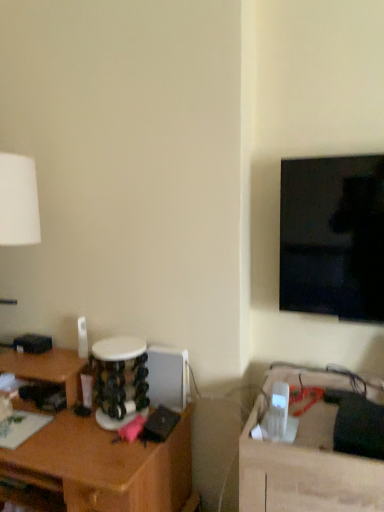
Question: Should I look upward or downward to see black glossy tv at upper right?

Choices:
 (A) down
 (B) up

Answer: (B)

Question: Is the surface of black glossy tv at upper right in direct contact with wooden table at lower right?

Choices:
 (A) no
 (B) yes

Answer: (A)

Question: Does black glossy tv at upper right have a larger size compared to wooden table at lower right?

Choices:
 (A) no
 (B) yes

Answer: (A)

Question: Is black glossy tv at upper right thinner than wooden table at lower right?

Choices:
 (A) yes
 (B) no

Answer: (A)

Question: Does black glossy tv at upper right have a smaller size compared to wooden table at lower right?

Choices:
 (A) yes
 (B) no

Answer: (A)

Question: Would you consider black glossy tv at upper right to be distant from wooden table at lower right?

Choices:
 (A) yes
 (B) no

Answer: (B)

Question: From a real-world perspective, is black glossy tv at upper right physically below wooden table at lower right?

Choices:
 (A) yes
 (B) no

Answer: (B)

Question: Is wooden table at lower right shorter than brown wood desk at left?

Choices:
 (A) no
 (B) yes

Answer: (B)

Question: Is wooden table at lower right further to the viewer compared to brown wood desk at left?

Choices:
 (A) yes
 (B) no

Answer: (B)

Question: Can you confirm if wooden table at lower right is positioned to the right of brown wood desk at left?

Choices:
 (A) no
 (B) yes

Answer: (B)

Question: Is wooden table at lower right in front of brown wood desk at left?

Choices:
 (A) yes
 (B) no

Answer: (A)

Question: Is wooden table at lower right thinner than brown wood desk at left?

Choices:
 (A) yes
 (B) no

Answer: (B)

Question: From a real-world perspective, does wooden table at lower right stand above brown wood desk at left?

Choices:
 (A) yes
 (B) no

Answer: (A)

Question: Considering the relative sizes of black glossy tv at upper right and brown wood desk at left in the image provided, is black glossy tv at upper right shorter than brown wood desk at left?

Choices:
 (A) yes
 (B) no

Answer: (A)